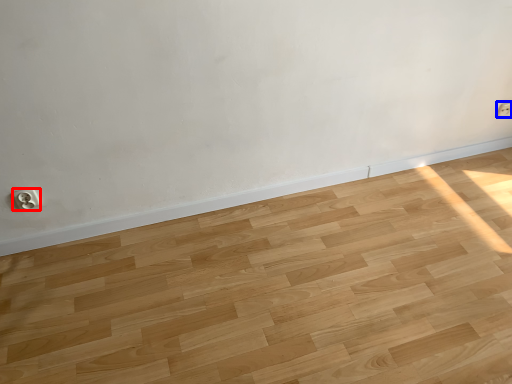
Question: Which point is further to the camera, electric outlet (highlighted by a red box) or electric outlet (highlighted by a blue box)?

Choices:
 (A) electric outlet
 (B) electric outlet

Answer: (B)